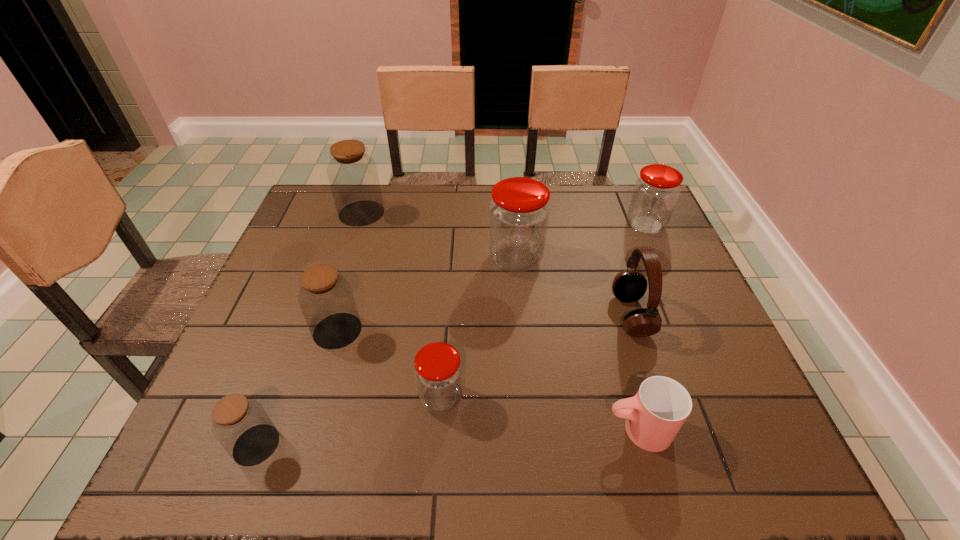
Where is `free location located 0.280m on the left of the leftmost red jar`? This screenshot has height=540, width=960. free location located 0.280m on the left of the leftmost red jar is located at coordinates (285, 397).

Find the location of a particular element. Image resolution: width=960 pixels, height=540 pixels. free space located 0.230m on the back of the smallest brown jar is located at coordinates (299, 333).

What are the coordinates of `vacant space located on the side of the cup with the handle` in the screenshot? It's located at (482, 429).

This screenshot has height=540, width=960. Identify the location of vacant space located on the side of the cup with the handle. (579, 429).

Find the location of a particular element. This screenshot has height=540, width=960. vacant space located 0.220m on the side of the cup with the handle is located at coordinates (492, 429).

Where is `jar located in the near edge section of the desktop`? jar located in the near edge section of the desktop is located at coordinates (240, 424).

Find the location of `cup that is positioned at the near edge`. cup that is positioned at the near edge is located at coordinates (654, 416).

At what (x,y) coordinates should I click in order to perform the action: click on headset located in the right edge section of the desktop. Please return your answer as a coordinate pair (x, y). This screenshot has height=540, width=960. Looking at the image, I should click on (628, 286).

This screenshot has height=540, width=960. I want to click on jar that is positioned at the right edge, so click(x=656, y=192).

Find the location of a particular element. This screenshot has width=960, height=540. object at the far left corner is located at coordinates (353, 176).